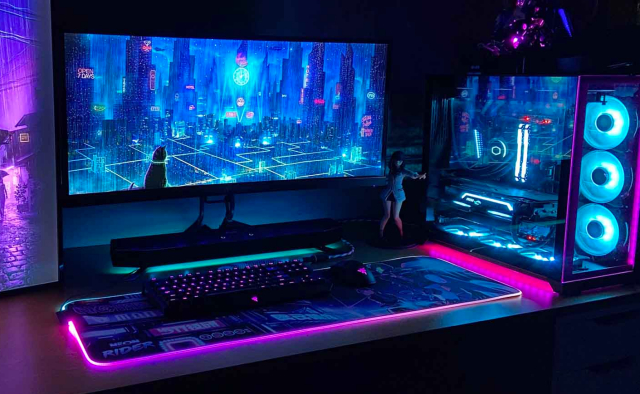
You are a GUI agent. You are given a task and a screenshot of the screen. Output one action in this format:
    pyautogui.click(x=<x>, y=<y>)
    Task: Click on the keyboard
    The height and width of the screenshot is (394, 640).
    Given the screenshot: What is the action you would take?
    pyautogui.click(x=241, y=283)